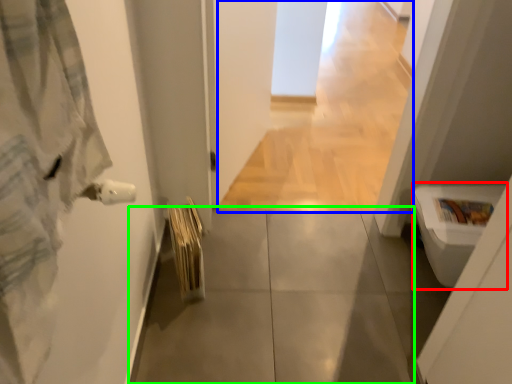
Question: Which object is the closest to the toilet bowl (highlighted by a red box)? Choose among these: corridor (highlighted by a blue box) or concrete (highlighted by a green box).

Choices:
 (A) corridor
 (B) concrete

Answer: (B)